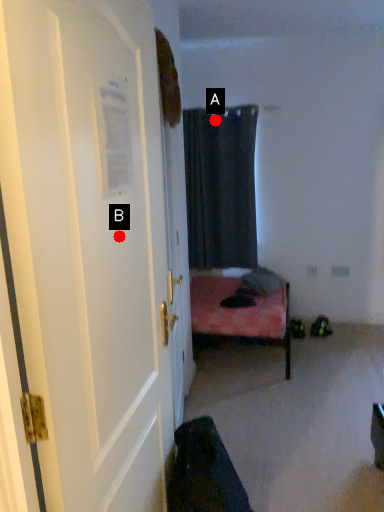
Question: Two points are circled on the image, labeled by A and B beside each circle. Among these points, which one is nearest to the camera?

Choices:
 (A) A is closer
 (B) B is closer

Answer: (B)